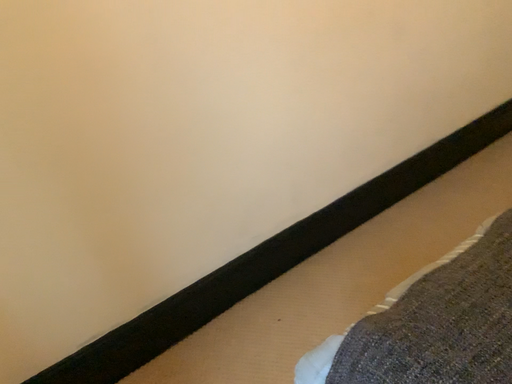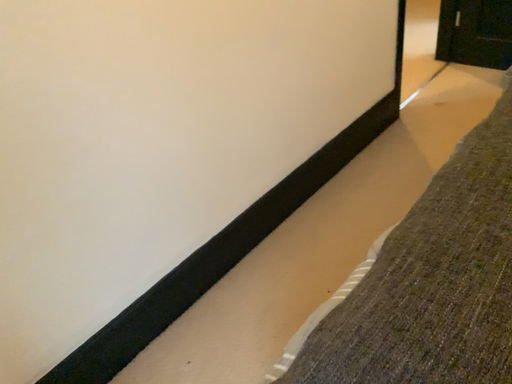
Question: How did the camera likely rotate when shooting the video?

Choices:
 (A) rotated right
 (B) rotated left

Answer: (A)